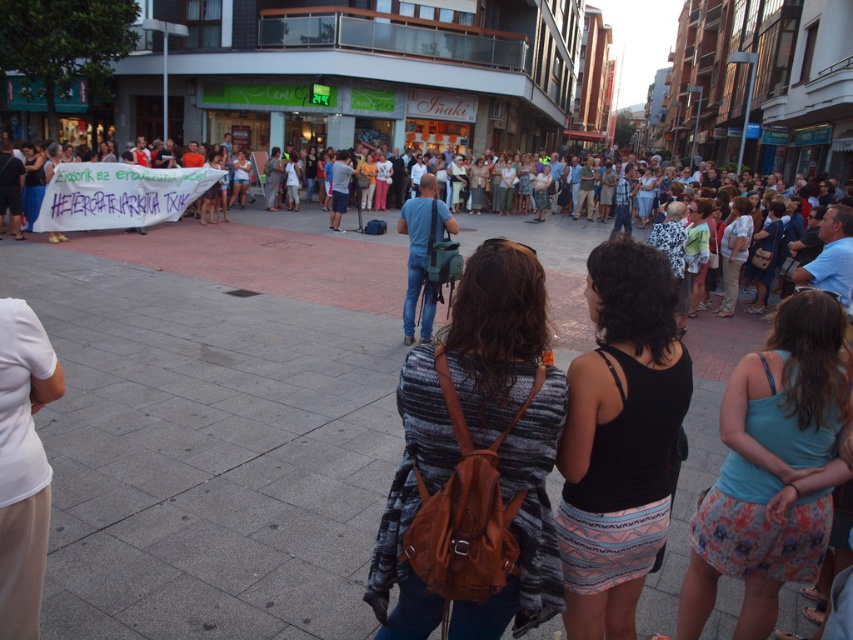
Question: Does black fabric skirt at center lie behind denim jeans at center?

Choices:
 (A) yes
 (B) no

Answer: (B)

Question: Among these points, which one is nearest to the camera?

Choices:
 (A) (810, 500)
 (B) (521, 324)

Answer: (B)

Question: Is black fabric skirt at center smaller than white cotton shirt at center?

Choices:
 (A) yes
 (B) no

Answer: (A)

Question: Does brown leather backpack at center lie in front of white cotton shirt at center?

Choices:
 (A) no
 (B) yes

Answer: (B)

Question: Which object is the farthest from the blue cotton tank top at center?

Choices:
 (A) white cotton shirt at center
 (B) brown leather backpack at center
 (C) gray concrete pavement at center

Answer: (A)

Question: Based on their relative distances, which object is nearer to the black fabric skirt at center?

Choices:
 (A) denim jeans at center
 (B) gray concrete pavement at center
 (C) brown leather backpack at center
 (D) white fabric at left

Answer: (C)